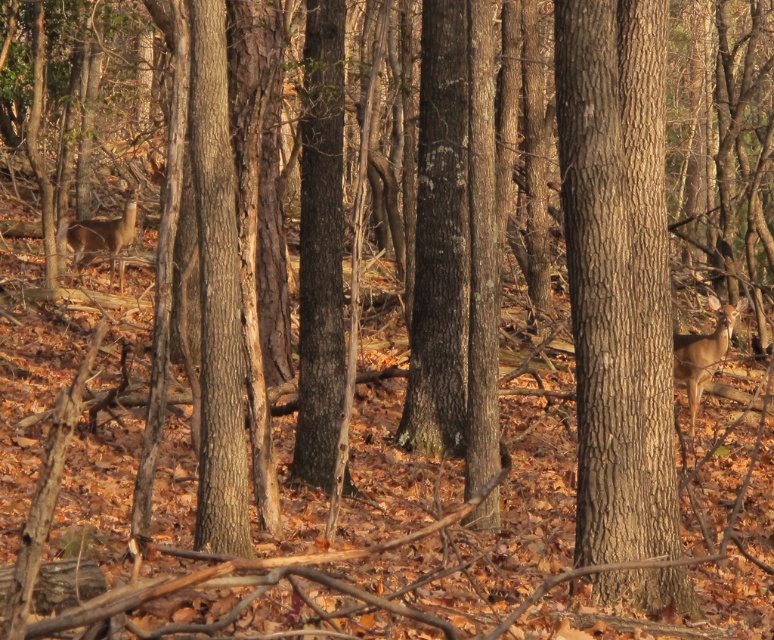
Question: Can you confirm if brown rough bark tree at center is positioned to the left of brown fur deer at left?

Choices:
 (A) no
 (B) yes

Answer: (A)

Question: Which is nearer to the brown fur deer at left?

Choices:
 (A) brown matte deer at right
 (B) brown rough bark tree at center

Answer: (A)

Question: Which object is positioned farthest from the brown fur deer at left?

Choices:
 (A) brown matte deer at right
 (B) brown rough bark tree at center

Answer: (B)

Question: Is the position of brown rough bark tree at center less distant than that of brown fur deer at left?

Choices:
 (A) no
 (B) yes

Answer: (B)

Question: Is brown matte deer at right wider than brown fur deer at left?

Choices:
 (A) no
 (B) yes

Answer: (A)

Question: Which point is farther from the camera taking this photo?

Choices:
 (A) (108, 252)
 (B) (717, 358)
 (C) (656, 387)

Answer: (A)